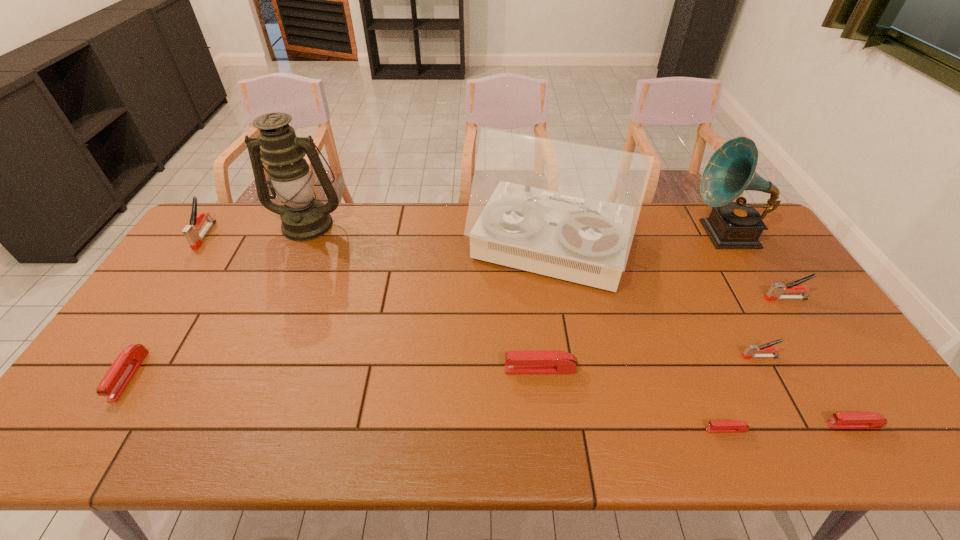
Identify which object is the fifth nearest to the shortest object. Please provide its 2D coordinates. Your answer should be formatted as a tuple, i.e. [(x, y)], where the tuple contains the x and y coordinates of a point satisfying the conditions above.

[(775, 292)]

Where is `object that is the second closest to the fifth tallest object`? This screenshot has height=540, width=960. object that is the second closest to the fifth tallest object is located at coordinates (750, 352).

At what (x,y) coordinates should I click in order to perform the action: click on stapler that stands as the fourth closest to the smallest gray stapler. Please return your answer as a coordinate pair (x, y). The height and width of the screenshot is (540, 960). Looking at the image, I should click on (537, 361).

You are a GUI agent. You are given a task and a screenshot of the screen. Output one action in this format:
    pyautogui.click(x=<x>, y=<y>)
    Task: Click on the stapler object that ranks as the third closest to the phonograph_record
    The image size is (960, 540).
    Given the screenshot: What is the action you would take?
    pyautogui.click(x=842, y=420)

Locate which gray stapler ranks second in proximity to the phonograph_record. Please provide its 2D coordinates. Your answer should be formatted as a tuple, i.e. [(x, y)], where the tuple contains the x and y coordinates of a point satisfying the conditions above.

[(750, 352)]

Identify which gray stapler is located as the second nearest to the record player. Please provide its 2D coordinates. Your answer should be formatted as a tuple, i.e. [(x, y)], where the tuple contains the x and y coordinates of a point satisfying the conditions above.

[(775, 292)]

Choose which red stapler is the third nearest neighbor to the eighth shortest object. Please provide its 2D coordinates. Your answer should be formatted as a tuple, i.e. [(x, y)], where the tuple contains the x and y coordinates of a point satisfying the conditions above.

[(537, 361)]

Locate which red stapler ranks third in proximity to the fifth object from right to left. Please provide its 2D coordinates. Your answer should be formatted as a tuple, i.e. [(x, y)], where the tuple contains the x and y coordinates of a point satisfying the conditions above.

[(119, 375)]